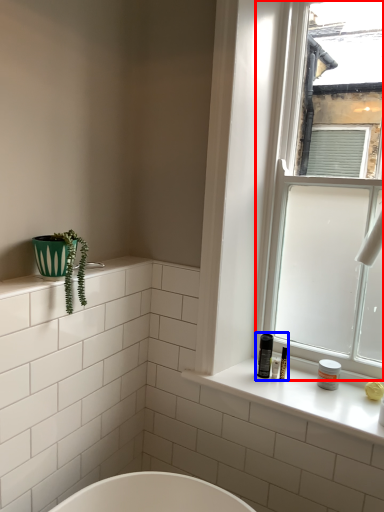
Question: Which point is closer to the camera, window (highlighted by a red box) or toiletry (highlighted by a blue box)?

Choices:
 (A) window
 (B) toiletry

Answer: (A)